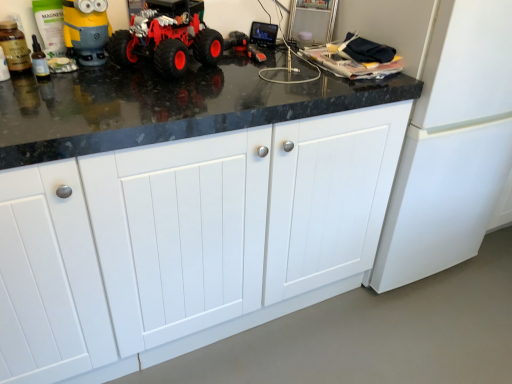
Question: From their relative heights in the image, would you say red rubber toy truck at center is taller or shorter than white matte cabinet at center?

Choices:
 (A) tall
 (B) short

Answer: (B)

Question: In terms of size, does red rubber toy truck at center appear bigger or smaller than white matte cabinet at center?

Choices:
 (A) small
 (B) big

Answer: (A)

Question: Considering their positions, is red rubber toy truck at center located in front of or behind white matte cabinet at center?

Choices:
 (A) behind
 (B) front

Answer: (A)

Question: From a real-world perspective, is white matte cabinet at center positioned above or below red rubber toy truck at center?

Choices:
 (A) below
 (B) above

Answer: (A)

Question: Is point (357, 233) positioned closer to the camera than point (117, 61)?

Choices:
 (A) farther
 (B) closer

Answer: (A)

Question: Would you say white matte cabinet at center is inside or outside red rubber toy truck at center?

Choices:
 (A) inside
 (B) outside

Answer: (B)

Question: Considering the positions of white matte cabinet at center and red rubber toy truck at center in the image, is white matte cabinet at center bigger or smaller than red rubber toy truck at center?

Choices:
 (A) small
 (B) big

Answer: (B)